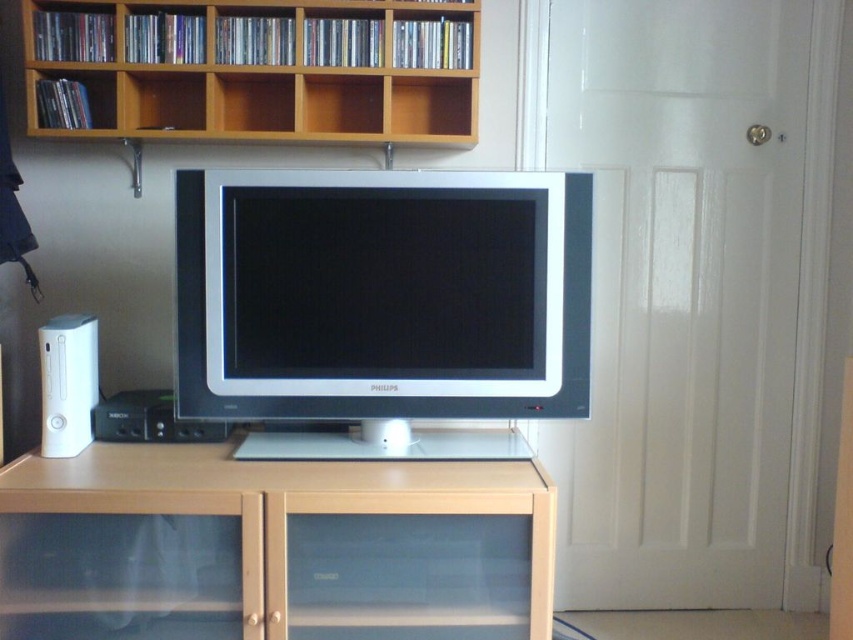
Measure the distance between point (509, 532) and camera.

Point (509, 532) and camera are 5.93 feet apart from each other.

Which is above, matte wood entertainment center at center or white plastic speaker at left?

white plastic speaker at left is above.

Identify the location of matte wood entertainment center at center. This screenshot has width=853, height=640. (289, 547).

Is beige wood cabinet at center to the right of wooden shelves at upper center from the viewer's perspective?

Yes, beige wood cabinet at center is to the right of wooden shelves at upper center.

Is beige wood cabinet at center shorter than wooden shelves at upper center?

No, beige wood cabinet at center is not shorter than wooden shelves at upper center.

What do you see at coordinates (271, 547) in the screenshot? This screenshot has width=853, height=640. I see `beige wood cabinet at center` at bounding box center [271, 547].

Locate an element on the screen. The height and width of the screenshot is (640, 853). beige wood cabinet at center is located at coordinates (271, 547).

Who is more distant from viewer, (265, 600) or (196, 452)?

The point (196, 452) is behind.

The width and height of the screenshot is (853, 640). What are the coordinates of `beige wood cabinet at center` in the screenshot? It's located at (271, 547).

Find the location of a particular element. The width and height of the screenshot is (853, 640). beige wood cabinet at center is located at coordinates (271, 547).